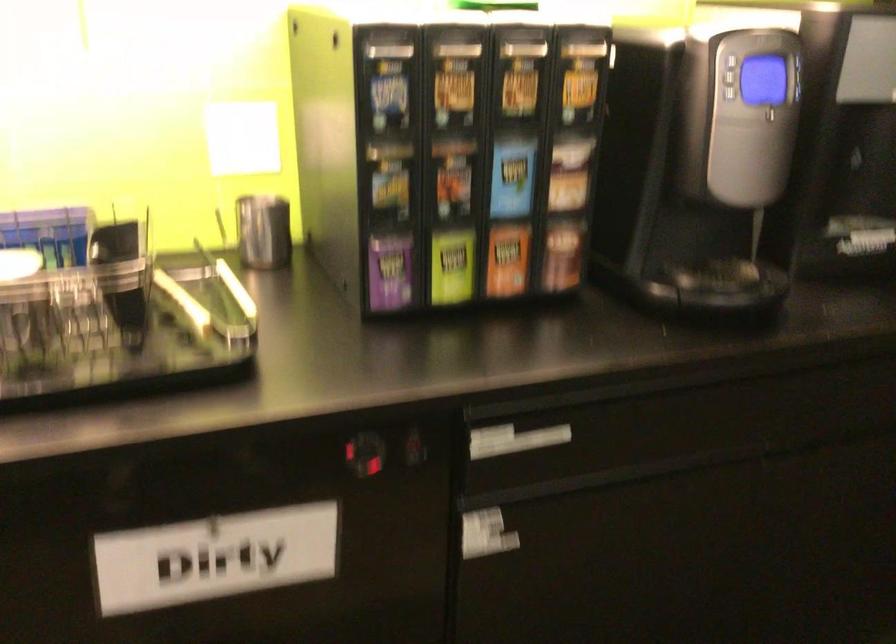
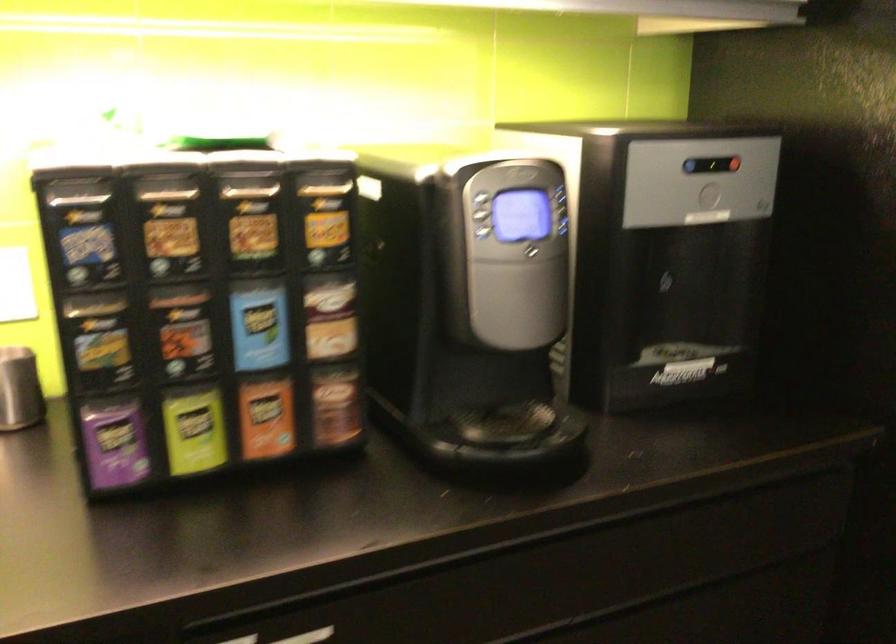
Where in the second image is the point corresponding to point (730, 93) from the first image?

(486, 232)